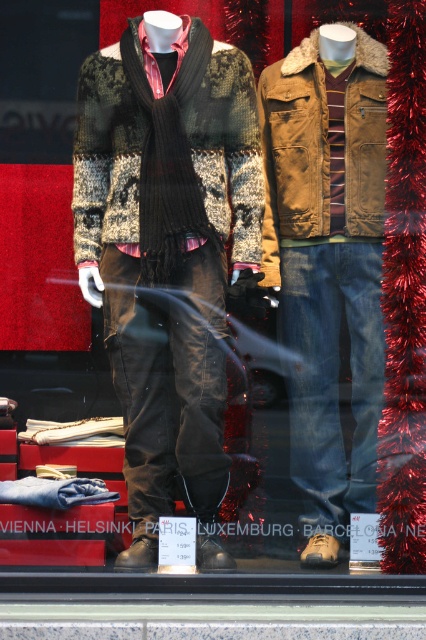
Question: From the image, what is the correct spatial relationship of denim jeans at center in relation to knitted patchwork sweater at center?

Choices:
 (A) left
 (B) right

Answer: (B)

Question: Which point is closer to the camera?

Choices:
 (A) (262, 243)
 (B) (141, 136)
 (C) (138, 204)

Answer: (B)

Question: Based on their relative distances, which object is farther from the knit sweater at center?

Choices:
 (A) knitted patchwork sweater at center
 (B) denim jeans at center
 (C) black ribbed scarf at center

Answer: (B)

Question: Is knit sweater at center positioned behind black ribbed scarf at center?

Choices:
 (A) no
 (B) yes

Answer: (B)

Question: Is knit sweater at center closer to camera compared to black ribbed scarf at center?

Choices:
 (A) yes
 (B) no

Answer: (B)

Question: Which of the following is the farthest from the observer?

Choices:
 (A) black ribbed scarf at center
 (B) knitted patchwork sweater at center
 (C) denim jeans at center

Answer: (C)